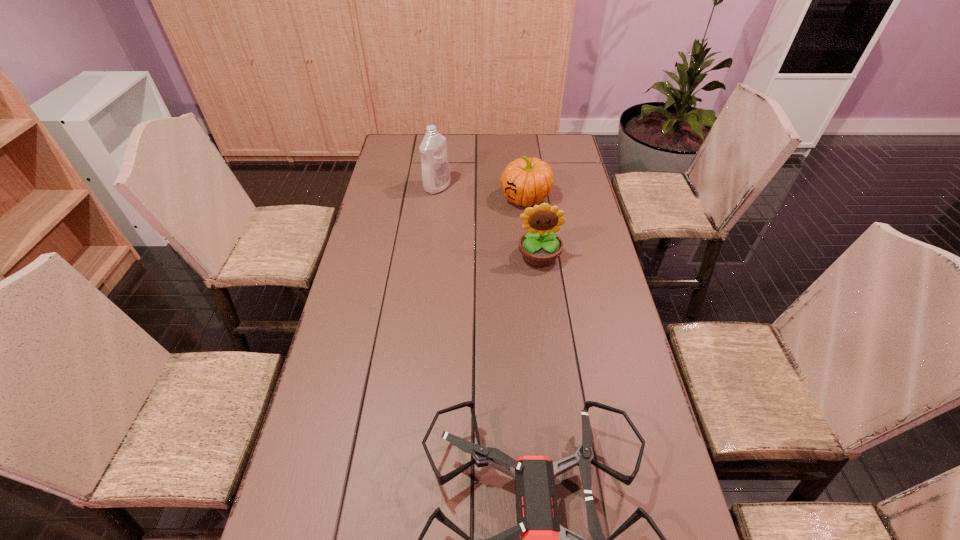
At what (x,y) coordinates should I click in order to perform the action: click on pumpkin positioned at the right edge. Please return your answer as a coordinate pair (x, y). The width and height of the screenshot is (960, 540). Looking at the image, I should click on (528, 181).

In order to click on vacant region at the far edge in this screenshot , I will do coord(448,155).

In the image, there is a desktop. Find the location of `vacant space at the left edge`. vacant space at the left edge is located at coordinates (350, 286).

Locate an element on the screen. The height and width of the screenshot is (540, 960). free region at the right edge of the desktop is located at coordinates (632, 343).

At what (x,y) coordinates should I click in order to perform the action: click on vacant region between the detergent and the third tallest object. Please return your answer as a coordinate pair (x, y). This screenshot has width=960, height=540. Looking at the image, I should click on (481, 193).

Locate an element on the screen. The height and width of the screenshot is (540, 960). blank region between the detergent and the third tallest object is located at coordinates (481, 193).

Identify the location of empty space between the pumpkin and the detergent. The height and width of the screenshot is (540, 960). (481, 193).

The image size is (960, 540). In order to click on vacant point located between the pumpkin and the detergent in this screenshot , I will do `click(481, 193)`.

Identify which object is the third nearest to the detergent. Please provide its 2D coordinates. Your answer should be formatted as a tuple, i.e. [(x, y)], where the tuple contains the x and y coordinates of a point satisfying the conditions above.

[(538, 539)]

Locate which object is the closest to the nearest object. Please provide its 2D coordinates. Your answer should be formatted as a tuple, i.e. [(x, y)], where the tuple contains the x and y coordinates of a point satisfying the conditions above.

[(540, 246)]